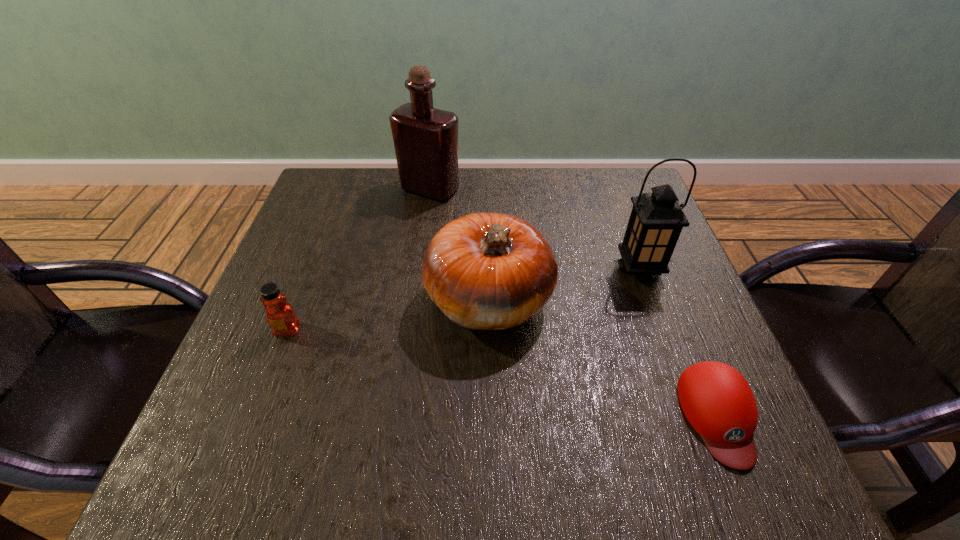
You are a GUI agent. You are given a task and a screenshot of the screen. Output one action in this format:
    pyautogui.click(x=<x>, y=<y>)
    Task: Click on the object that can be found as the fourth closest to the liquor
    
    Given the screenshot: What is the action you would take?
    pyautogui.click(x=716, y=399)

Where is `object that stands as the closest to the second tallest object`? This screenshot has width=960, height=540. object that stands as the closest to the second tallest object is located at coordinates (485, 271).

Image resolution: width=960 pixels, height=540 pixels. I want to click on free space that satisfies the following two spatial constraints: 1. on the back side of the third shortest object; 2. on the left side of the second tallest object, so click(489, 269).